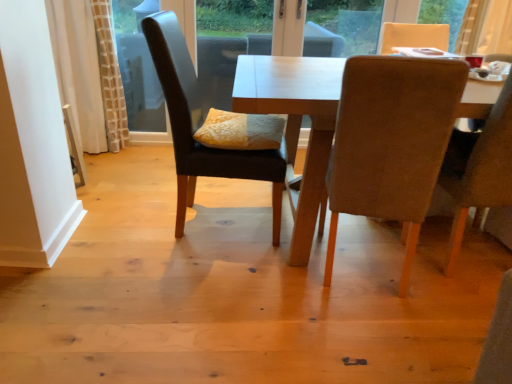
Question: Considering the relative sizes of light brown wooden table at center and beige fabric chair at right, positioned as the third chair in left-to-right order, in the image provided, is light brown wooden table at center smaller than beige fabric chair at right, positioned as the third chair in left-to-right order,?

Choices:
 (A) no
 (B) yes

Answer: (A)

Question: Does light brown wooden table at center have a lesser width compared to beige fabric chair at right, positioned as the third chair in left-to-right order?

Choices:
 (A) no
 (B) yes

Answer: (A)

Question: Can you confirm if light brown wooden table at center is bigger than beige fabric chair at right, placed as the 1th chair when sorted from right to left?

Choices:
 (A) no
 (B) yes

Answer: (B)

Question: Can you confirm if light brown wooden table at center is taller than beige fabric chair at right, positioned as the third chair in left-to-right order?

Choices:
 (A) no
 (B) yes

Answer: (A)

Question: Is beige fabric chair at right, placed as the 1th chair when sorted from right to left, completely or partially inside light brown wooden table at center?

Choices:
 (A) yes
 (B) no

Answer: (A)

Question: From the image's perspective, is dark brown leather chair at center, which is counted as the 1th chair, starting from the left, positioned above or below velvet beige chair at right, which is the 2th chair in right-to-left order?

Choices:
 (A) above
 (B) below

Answer: (A)

Question: In terms of width, does dark brown leather chair at center, which is counted as the 1th chair, starting from the left, look wider or thinner when compared to velvet beige chair at right, the 2th chair when ordered from left to right?

Choices:
 (A) wide
 (B) thin

Answer: (A)

Question: Considering the positions of point (219, 175) and point (415, 105), is point (219, 175) closer or farther from the camera than point (415, 105)?

Choices:
 (A) closer
 (B) farther

Answer: (B)

Question: Is dark brown leather chair at center, which appears as the 3th chair when viewed from the right, to the left or to the right of velvet beige chair at right, which is the 2th chair in right-to-left order, in the image?

Choices:
 (A) right
 (B) left

Answer: (B)

Question: Choose the correct answer: Is yellow textured pillow at center inside dark brown leather chair at center, which is counted as the 1th chair, starting from the left, or outside it?

Choices:
 (A) inside
 (B) outside

Answer: (A)

Question: Considering the positions of point (212, 112) and point (274, 200), is point (212, 112) closer or farther from the camera than point (274, 200)?

Choices:
 (A) farther
 (B) closer

Answer: (A)

Question: Considering the positions of yellow textured pillow at center and dark brown leather chair at center, which appears as the 3th chair when viewed from the right, in the image, is yellow textured pillow at center wider or thinner than dark brown leather chair at center, which appears as the 3th chair when viewed from the right,?

Choices:
 (A) thin
 (B) wide

Answer: (A)

Question: Looking at the image, does yellow textured pillow at center seem bigger or smaller compared to dark brown leather chair at center, which is counted as the 1th chair, starting from the left?

Choices:
 (A) big
 (B) small

Answer: (B)

Question: Which is correct: transparent glass window screen at upper left is inside yellow textured pillow at center, or outside of it?

Choices:
 (A) outside
 (B) inside

Answer: (A)

Question: Relative to yellow textured pillow at center, is transparent glass window screen at upper left in front or behind?

Choices:
 (A) front
 (B) behind

Answer: (B)